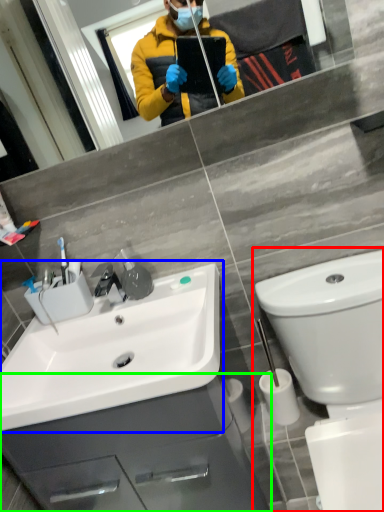
Question: Based on their relative distances, which object is farther from toilet (highlighted by a red box)? Choose from sink (highlighted by a blue box) and bathroom cabinet (highlighted by a green box).

Choices:
 (A) sink
 (B) bathroom cabinet

Answer: (B)